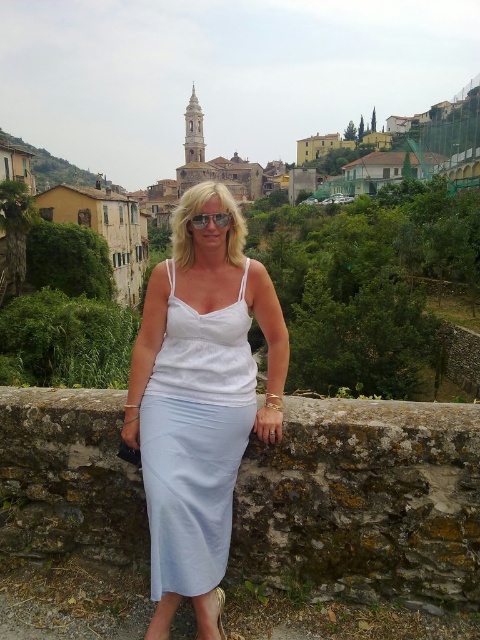
Does white cotton dress at center appear over white fabric sandal at lower center?

Yes.

This screenshot has height=640, width=480. Find the location of `white cotton dress at center`. white cotton dress at center is located at coordinates (200, 396).

Does white cotton dress at center have a greater height compared to green grassy hillside at upper left?

No.

Who is positioned more to the right, white cotton dress at center or green grassy hillside at upper left?

white cotton dress at center

Is point (166, 291) positioned in front of point (76, 172)?

Yes, it is in front of point (76, 172).

This screenshot has height=640, width=480. Identify the location of white cotton dress at center. (200, 396).

Is white fabric sandal at lower center positioned at the back of transparent plastic goggles at center?

No, white fabric sandal at lower center is closer to the viewer.

Which of these two, white fabric sandal at lower center or transparent plastic goggles at center, stands taller?

white fabric sandal at lower center

Where is `white fabric sandal at lower center`? white fabric sandal at lower center is located at coordinates (208, 614).